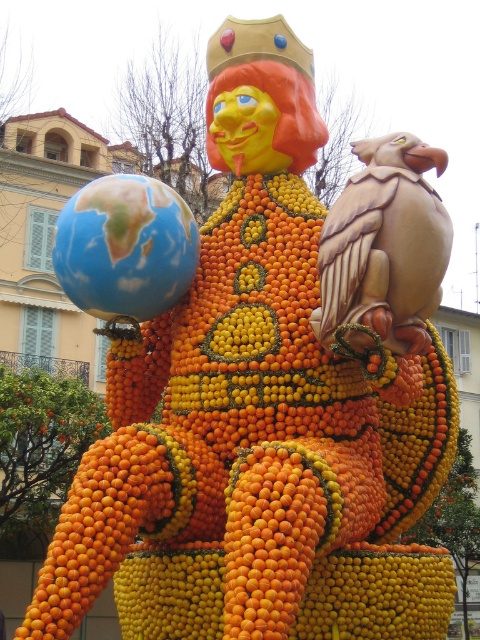
Question: Which of these objects is positioned farthest from the blue glossy globe at left?

Choices:
 (A) orange matte at lower center
 (B) orange textured globe at left

Answer: (A)

Question: Can you confirm if blue glossy globe at left is positioned to the right of orange matte at lower center?

Choices:
 (A) no
 (B) yes

Answer: (A)

Question: Which object appears farthest from the camera in this image?

Choices:
 (A) orange textured globe at left
 (B) orange matte at lower center

Answer: (B)

Question: Does blue glossy globe at left appear on the left side of orange matte at lower center?

Choices:
 (A) no
 (B) yes

Answer: (B)

Question: Which is farther from the orange textured globe at left?

Choices:
 (A) orange matte at lower center
 (B) blue glossy globe at left

Answer: (B)

Question: Does orange textured globe at left have a smaller size compared to orange matte at lower center?

Choices:
 (A) no
 (B) yes

Answer: (A)